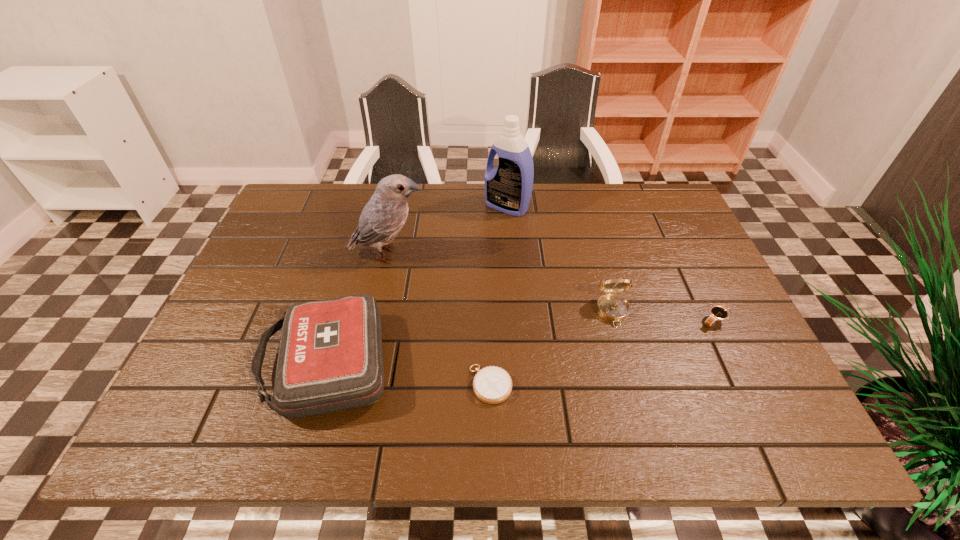
This screenshot has height=540, width=960. I want to click on free space located 0.100m on the front of the detergent, so click(x=510, y=240).

Locate an element on the screen. This screenshot has width=960, height=540. vacant position located 0.330m on the front-facing side of the parrot is located at coordinates (552, 254).

Find the location of a particular element. The height and width of the screenshot is (540, 960). free space located 0.220m with the dial facing the farther compass is located at coordinates tap(642, 417).

Locate an element on the screen. This screenshot has height=540, width=960. vacant region located 0.270m on the right of the first-aid kit is located at coordinates (519, 364).

You are a GUI agent. You are given a task and a screenshot of the screen. Output one action in this format:
    pyautogui.click(x=<x>, y=<y>)
    Task: Click on the free space located on the left of the watch
    
    Given the screenshot: What is the action you would take?
    pyautogui.click(x=543, y=320)

The height and width of the screenshot is (540, 960). In order to click on vacant region located on the back of the nearer compass in this screenshot , I will do `click(488, 245)`.

Find the location of `object situated at the far edge`. object situated at the far edge is located at coordinates (508, 188).

Find the location of a particular element. The width and height of the screenshot is (960, 540). the first-aid kit that is at the near edge is located at coordinates (330, 358).

At what (x,y) coordinates should I click in order to perform the action: click on compass that is positioned at the near edge. Please return your answer as a coordinate pair (x, y). The width and height of the screenshot is (960, 540). Looking at the image, I should click on (492, 384).

Locate an element on the screen. object that is at the left edge is located at coordinates (330, 358).